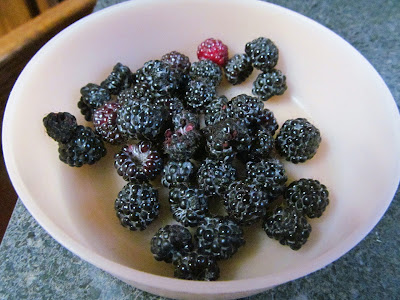
This screenshot has width=400, height=300. In order to click on base of white bowl in this screenshot , I will do `click(276, 110)`.